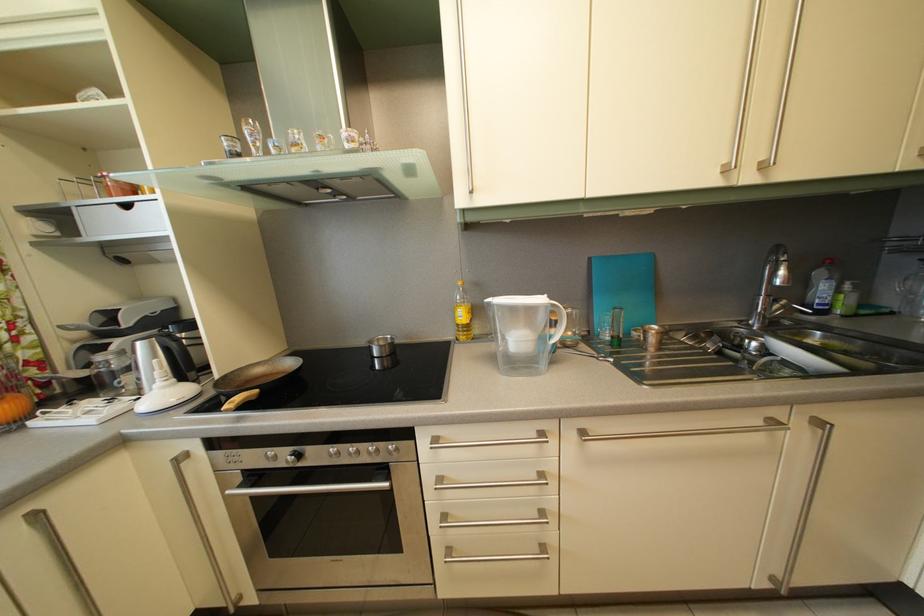
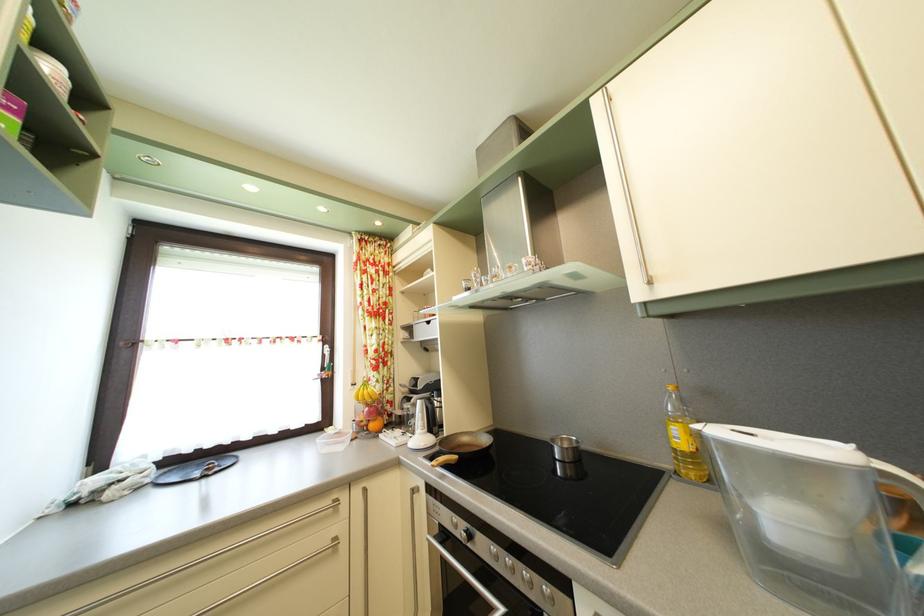
Find the pixel in the second image that matches [484,292] in the first image.

(715, 400)